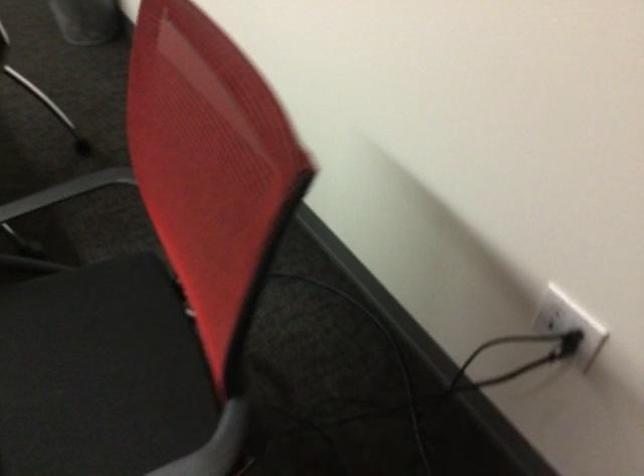
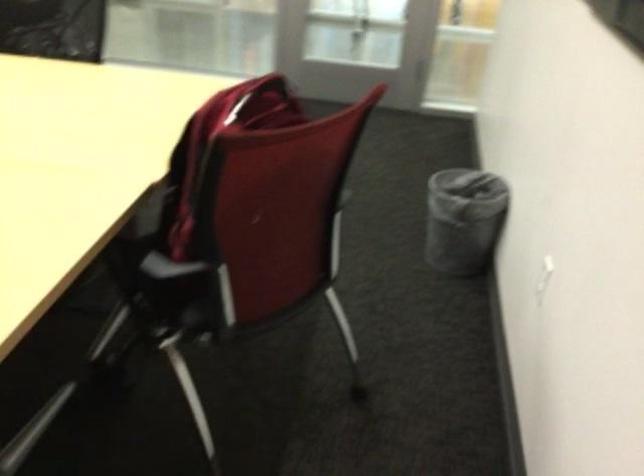
Question: The camera is either moving clockwise (left) or counter-clockwise (right) around the object. The first image is from the beginning of the video and the second image is from the end. Is the camera moving left or right when shooting the video?

Choices:
 (A) Left
 (B) Right

Answer: (B)